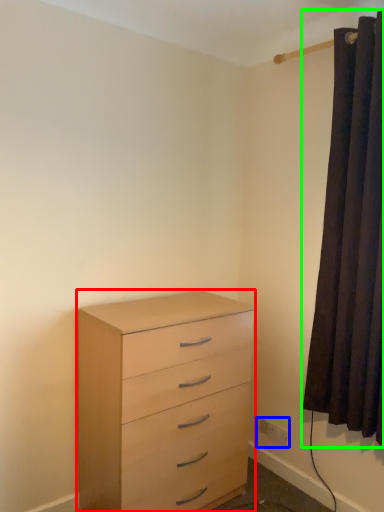
Question: Which is nearer to the chest of drawers (highlighted by a red box)? electric outlet (highlighted by a blue box) or curtain (highlighted by a green box).

Choices:
 (A) electric outlet
 (B) curtain

Answer: (B)